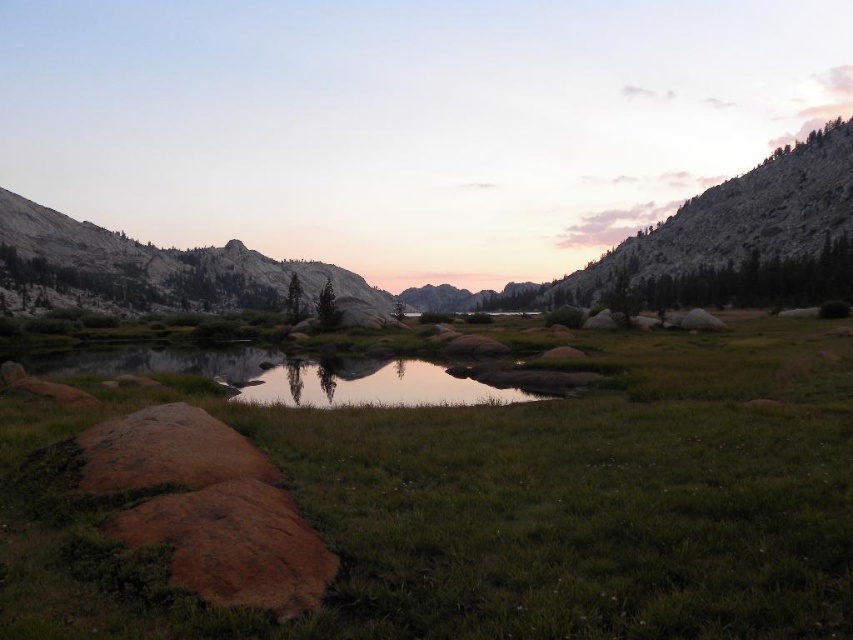
Question: Which is farther from the clear water at center?

Choices:
 (A) green grassy at lower left
 (B) granite rock formation at upper left

Answer: (B)

Question: Does green grassy at lower left appear on the left side of clear water at center?

Choices:
 (A) yes
 (B) no

Answer: (B)

Question: Estimate the real-world distances between objects in this image. Which object is closer to the clear water at center?

Choices:
 (A) green grassy at lower left
 (B) granite rock formation at upper left

Answer: (A)

Question: Is green grassy at lower left further to the viewer compared to granite rock formation at upper left?

Choices:
 (A) no
 (B) yes

Answer: (A)

Question: Observing the image, what is the correct spatial positioning of green grassy at lower left in reference to clear water at center?

Choices:
 (A) right
 (B) left

Answer: (A)

Question: Which object is closer to the camera taking this photo?

Choices:
 (A) granite rock formation at upper left
 (B) green grassy at lower left
 (C) clear water at center

Answer: (B)